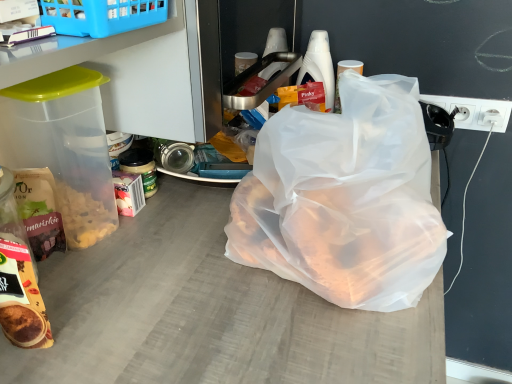
Locate an element on the screen. The height and width of the screenshot is (384, 512). transparent plastic bag at center is located at coordinates (344, 198).

You are a GUI agent. You are given a task and a screenshot of the screen. Output one action in this format:
    pyautogui.click(x=<x>, y=<y>)
    Task: Click on the white plastic bottle at upper right
    The width and height of the screenshot is (512, 384).
    Given the screenshot: What is the action you would take?
    pyautogui.click(x=319, y=66)

Identify the location of matte brown snack bag at lower left. This screenshot has height=384, width=512. (19, 278).

Is transparent plastic bag at center far from white plastic bottle at upper right?

That's not correct — transparent plastic bag at center is a little close to white plastic bottle at upper right.

Looking at this image, is transparent plastic bag at center facing away from white plastic bottle at upper right?

transparent plastic bag at center does not have its back to white plastic bottle at upper right.

Does transparent plastic bag at center contain white plastic bottle at upper right?

No, white plastic bottle at upper right is located outside of transparent plastic bag at center.

Does matte brown snack bag at lower left have a lesser height compared to matte brown bag of cereal at left?

Yes.

From the image's perspective, which is above, matte brown snack bag at lower left or matte brown bag of cereal at left?

From the image's view, matte brown bag of cereal at left is above.

Are matte brown snack bag at lower left and matte brown bag of cereal at left beside each other?

Yes, matte brown snack bag at lower left is with matte brown bag of cereal at left.

Does matte brown snack bag at lower left have a lesser width compared to matte brown bag of cereal at left?

Incorrect, the width of matte brown snack bag at lower left is not less than that of matte brown bag of cereal at left.

Is white plastic bottle at upper right in front of or behind transparent plastic bag at center in the image?

white plastic bottle at upper right is positioned farther from the viewer than transparent plastic bag at center.

Does white plastic bottle at upper right touch transparent plastic bag at center?

No, white plastic bottle at upper right is not touching transparent plastic bag at center.

Considering the sizes of white plastic bottle at upper right and transparent plastic bag at center in the image, is white plastic bottle at upper right bigger or smaller than transparent plastic bag at center?

white plastic bottle at upper right is smaller than transparent plastic bag at center.

Identify the location of bottle behind the transparent plastic bag at center. This screenshot has height=384, width=512. (319, 66).

From a real-world perspective, relative to transparent plastic bag at center, is matte brown snack bag at lower left vertically above or below?

matte brown snack bag at lower left is below transparent plastic bag at center.

Where is `snack below the transparent plastic bag at center (from a real-world perspective)`? Image resolution: width=512 pixels, height=384 pixels. snack below the transparent plastic bag at center (from a real-world perspective) is located at coordinates (19, 278).

Consider the image. Who is shorter, matte brown snack bag at lower left or transparent plastic bag at center?

matte brown snack bag at lower left.

How many degrees apart are the facing directions of matte brown snack bag at lower left and transparent plastic bag at center?

matte brown snack bag at lower left and transparent plastic bag at center are facing 5.32 degrees away from each other.

How many degrees apart are the facing directions of matte brown snack bag at lower left and white plastic bottle at upper right?

There is a 2.79-degree angle between the facing directions of matte brown snack bag at lower left and white plastic bottle at upper right.

Based on the photo, between matte brown snack bag at lower left and white plastic bottle at upper right, which one has larger width?

With larger width is matte brown snack bag at lower left.

From a real-world perspective, which object rests below the other?

In real-world perspective, matte brown snack bag at lower left is lower.

Measure the distance between matte brown snack bag at lower left and white plastic bottle at upper right.

79.10 centimeters.

Which object is thinner, transparent plastic bag at center or matte brown bag of cereal at left?

With smaller width is matte brown bag of cereal at left.

Consider the image. Is transparent plastic bag at center positioned with its back to matte brown bag of cereal at left?

Yes, transparent plastic bag at center is facing away from matte brown bag of cereal at left.

Considering the relative sizes of transparent plastic bag at center and matte brown bag of cereal at left in the image provided, is transparent plastic bag at center shorter than matte brown bag of cereal at left?

In fact, transparent plastic bag at center may be taller than matte brown bag of cereal at left.

Between transparent plastic bag at center and matte brown bag of cereal at left, which one appears on the right side from the viewer's perspective?

transparent plastic bag at center is more to the right.

Is white plastic bottle at upper right taller or shorter than white plastic socket at right?

white plastic bottle at upper right is taller than white plastic socket at right.

From the image's perspective, is white plastic bottle at upper right on white plastic socket at right?

Yes.

Is white plastic bottle at upper right not close to white plastic socket at right?

No, white plastic bottle at upper right is not far away from white plastic socket at right.

Which is behind, white plastic bottle at upper right or white plastic socket at right?

white plastic socket at right is further from the camera.

Find the location of a particular element. bottle on the right of the transparent plastic bag at center is located at coordinates (319, 66).

Where is `snack below the matte brown bag of cereal at left (from a real-world perspective)`? The image size is (512, 384). snack below the matte brown bag of cereal at left (from a real-world perspective) is located at coordinates (19, 278).

Considering their positions, is transparent plastic bag at center positioned further to matte brown snack bag at lower left than matte brown bag of cereal at left?

The object further to matte brown snack bag at lower left is transparent plastic bag at center.

Looking at this image, based on their spatial positions, is white plastic bottle at upper right or matte brown bag of cereal at left further from matte brown snack bag at lower left?

white plastic bottle at upper right is positioned further to the anchor matte brown snack bag at lower left.

Considering their positions, is white plastic bottle at upper right positioned closer to matte brown bag of cereal at left than white plastic socket at right?

The object closer to matte brown bag of cereal at left is white plastic bottle at upper right.

Considering their positions, is white plastic socket at right positioned closer to matte brown snack bag at lower left than matte brown bag of cereal at left?

matte brown bag of cereal at left is closer to matte brown snack bag at lower left.

Considering their positions, is white plastic socket at right positioned further to matte brown bag of cereal at left than transparent plastic bag at center?

Based on the image, white plastic socket at right appears to be further to matte brown bag of cereal at left.

Estimate the real-world distances between objects in this image. Which object is closer to matte brown bag of cereal at left, matte brown snack bag at lower left or transparent plastic bag at center?

Based on the image, matte brown snack bag at lower left appears to be nearer to matte brown bag of cereal at left.

Estimate the real-world distances between objects in this image. Which object is further from matte brown bag of cereal at left, matte brown snack bag at lower left or white plastic bottle at upper right?

white plastic bottle at upper right.

Considering their positions, is white plastic socket at right positioned closer to matte brown snack bag at lower left than transparent plastic bag at center?

Based on the image, transparent plastic bag at center appears to be nearer to matte brown snack bag at lower left.

Find the location of a particular element. The width and height of the screenshot is (512, 384). cereal between matte brown snack bag at lower left and transparent plastic bag at center in the horizontal direction is located at coordinates coord(39,211).

Image resolution: width=512 pixels, height=384 pixels. I want to click on bottle positioned between transparent plastic bag at center and white plastic socket at right from near to far, so click(x=319, y=66).

Locate an element on the screen. Image resolution: width=512 pixels, height=384 pixels. plastic bag situated between matte brown bag of cereal at left and white plastic socket at right from left to right is located at coordinates (344, 198).

Locate an element on the screen. The image size is (512, 384). cereal between matte brown snack bag at lower left and white plastic bottle at upper right is located at coordinates (39, 211).